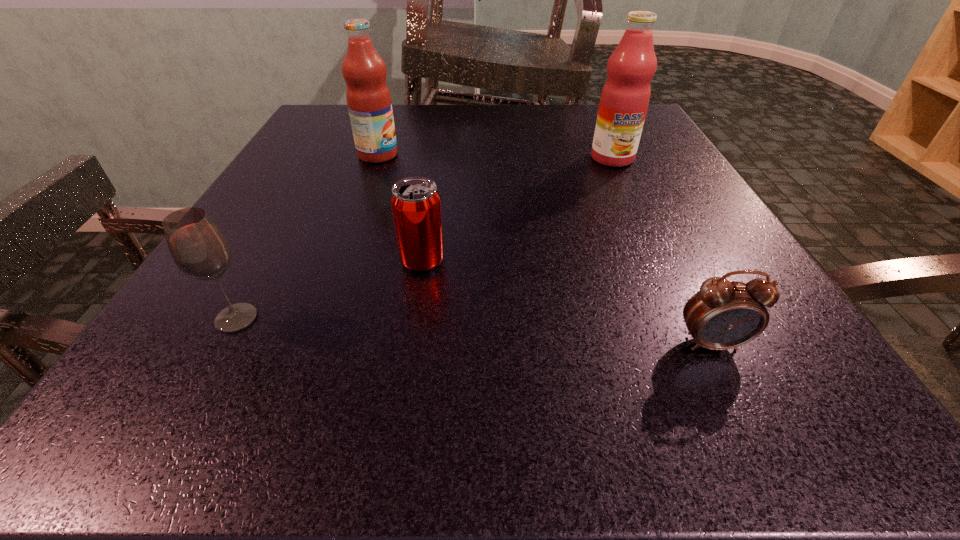
The image size is (960, 540). In order to click on vacant space at the left edge of the desktop in this screenshot , I will do `click(158, 363)`.

Image resolution: width=960 pixels, height=540 pixels. What are the coordinates of `vacant position at the right edge of the desktop` in the screenshot? It's located at (634, 211).

Identify the location of free space at the far left corner of the desktop. (312, 136).

Where is `vacant region at the near right corner of the desktop`? vacant region at the near right corner of the desktop is located at coordinates (716, 387).

I want to click on free space between the third object from left to right and the third shortest object, so click(329, 290).

At what (x,y) coordinates should I click in order to perform the action: click on vacant area between the third object from right to left and the alarm clock. Please return your answer as a coordinate pair (x, y). Image resolution: width=960 pixels, height=540 pixels. Looking at the image, I should click on (566, 302).

The image size is (960, 540). Identify the location of vacant space that's between the alarm clock and the third object from right to left. (566, 302).

The width and height of the screenshot is (960, 540). Identify the location of free point between the leftmost object and the left fruit juice. (307, 237).

Locate an element on the screen. This screenshot has width=960, height=540. vacant point located between the third shortest object and the third farthest object is located at coordinates click(x=329, y=290).

At what (x,y) coordinates should I click in order to perform the action: click on free space between the alarm clock and the left fruit juice. Please return your answer as a coordinate pair (x, y). Looking at the image, I should click on (544, 249).